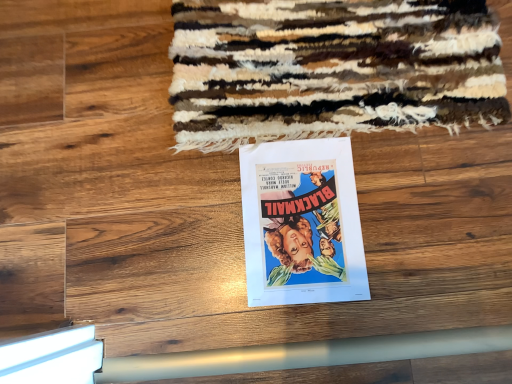
At what (x,y) coordinates should I click in order to perform the action: click on vacant space underneath matte paper poster at center (from a real-world perspective). Please return your answer as a coordinate pair (x, y). This screenshot has width=512, height=384. Looking at the image, I should click on tap(303, 218).